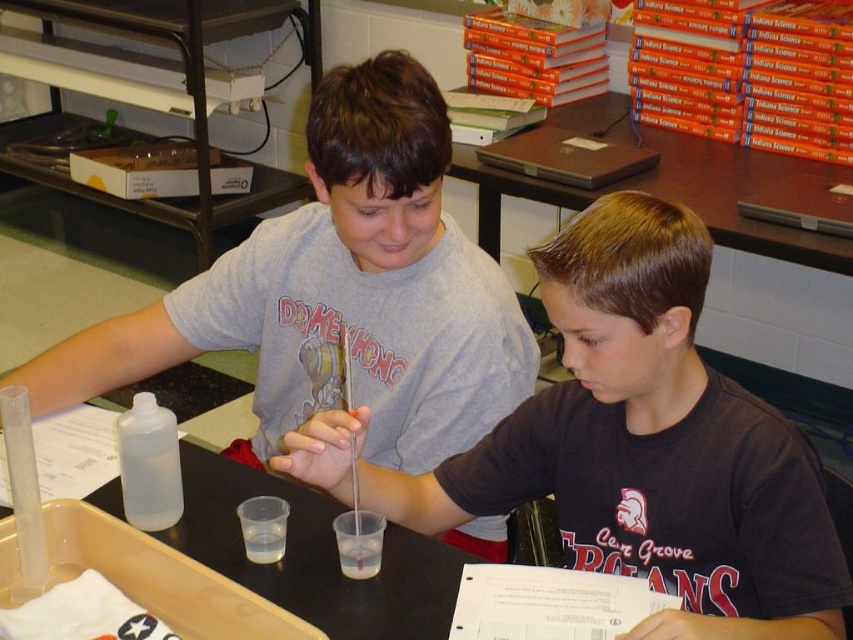
Question: Which object is the closest to the gray matte shirt at upper center?

Choices:
 (A) transparent plastic bottle at center-left
 (B) brown wooden table at upper center
 (C) black matte shirt at center

Answer: (C)

Question: Observing the image, what is the correct spatial positioning of black matte shirt at center in reference to brown wooden table at upper center?

Choices:
 (A) left
 (B) right

Answer: (A)

Question: Does gray matte shirt at upper center appear on the left side of brown wooden table at upper center?

Choices:
 (A) yes
 (B) no

Answer: (A)

Question: Is gray matte shirt at upper center to the left of transparent plastic bottle at center-left from the viewer's perspective?

Choices:
 (A) no
 (B) yes

Answer: (A)

Question: Which object appears closest to the camera in this image?

Choices:
 (A) gray matte shirt at upper center
 (B) black matte shirt at center
 (C) brown wooden table at upper center

Answer: (B)

Question: Which object is positioned farthest from the brown wooden table at upper center?

Choices:
 (A) black matte shirt at center
 (B) gray matte shirt at upper center
 (C) transparent plastic bottle at center-left

Answer: (C)